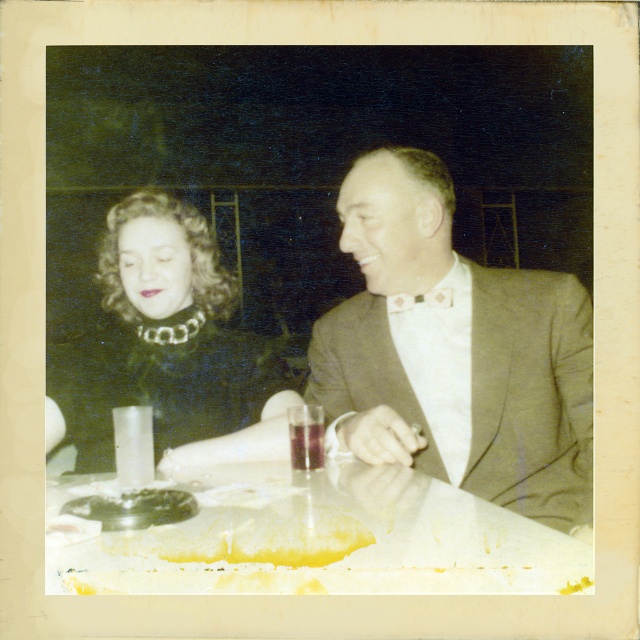
Question: Among these objects, which one is nearest to the camera?

Choices:
 (A) green velvet dress at left
 (B) translucent glass at table center

Answer: (B)

Question: Is light brown textured suit at center smaller than white paper at center?

Choices:
 (A) no
 (B) yes

Answer: (A)

Question: Which object appears farthest from the camera in this image?

Choices:
 (A) yellow wax at lower center
 (B) white paper at center

Answer: (A)

Question: From the image, what is the correct spatial relationship of yellow wax at lower center in relation to translucent glass at table center?

Choices:
 (A) above
 (B) below

Answer: (B)

Question: Which object is positioned farthest from the light brown textured suit at center?

Choices:
 (A) white paper at center
 (B) yellow wax at lower center
 (C) translucent glass at table center

Answer: (B)

Question: Considering the relative positions of light brown textured suit at center and translucent glass at table center in the image provided, where is light brown textured suit at center located with respect to translucent glass at table center?

Choices:
 (A) below
 (B) above

Answer: (B)